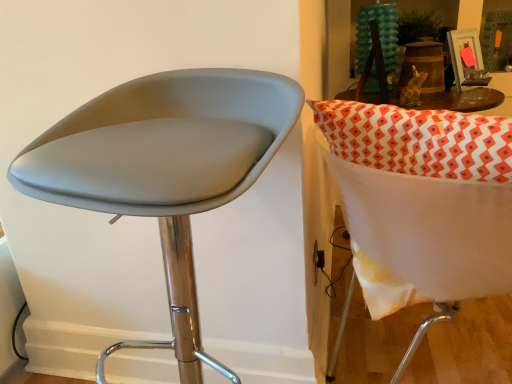
You are a GUI agent. You are given a task and a screenshot of the screen. Output one action in this format:
    pyautogui.click(x=<x>, y=<y>)
    Task: Click on the matte gray stool at left, placed as the second chair when sorted from right to left
    The width and height of the screenshot is (512, 384).
    Given the screenshot: What is the action you would take?
    pyautogui.click(x=165, y=163)

The height and width of the screenshot is (384, 512). Describe the element at coordinates (165, 163) in the screenshot. I see `matte gray stool at left, which is the 1th chair in left-to-right order` at that location.

Where is `white fabric chair at right, placed as the 2th chair when sorted from left to right`? white fabric chair at right, placed as the 2th chair when sorted from left to right is located at coordinates (425, 193).

What do you see at coordinates (425, 193) in the screenshot? Image resolution: width=512 pixels, height=384 pixels. I see `white fabric chair at right, placed as the 2th chair when sorted from left to right` at bounding box center [425, 193].

Identify the location of matte gray stool at left, placed as the second chair when sorted from right to left. (165, 163).

Does white fabric chair at right, which appears as the first chair when viewed from the right, appear on the right side of matte gray stool at left, which is the 1th chair in left-to-right order?

Yes, white fabric chair at right, which appears as the first chair when viewed from the right, is to the right of matte gray stool at left, which is the 1th chair in left-to-right order.

Is white fabric chair at right, placed as the 2th chair when sorted from left to right, positioned before matte gray stool at left, placed as the second chair when sorted from right to left?

No, white fabric chair at right, placed as the 2th chair when sorted from left to right, is further to the viewer.

Considering the positions of point (480, 238) and point (141, 172), is point (480, 238) closer or farther from the camera than point (141, 172)?

Clearly, point (480, 238) is more distant from the camera than point (141, 172).

From the image's perspective, would you say white fabric chair at right, which appears as the first chair when viewed from the right, is positioned over matte gray stool at left, which is the 1th chair in left-to-right order?

Yes.

From a real-world perspective, which is physically above, white fabric chair at right, placed as the 2th chair when sorted from left to right, or matte gray stool at left, placed as the second chair when sorted from right to left?

matte gray stool at left, placed as the second chair when sorted from right to left, from a real-world perspective.

Can you confirm if white fabric chair at right, which appears as the first chair when viewed from the right, is wider than matte gray stool at left, which is the 1th chair in left-to-right order?

Indeed, white fabric chair at right, which appears as the first chair when viewed from the right, has a greater width compared to matte gray stool at left, which is the 1th chair in left-to-right order.

Is white fabric chair at right, placed as the 2th chair when sorted from left to right, taller than matte gray stool at left, placed as the second chair when sorted from right to left?

Incorrect, the height of white fabric chair at right, placed as the 2th chair when sorted from left to right, is not larger of that of matte gray stool at left, placed as the second chair when sorted from right to left.

Which of these two, white fabric chair at right, placed as the 2th chair when sorted from left to right, or matte gray stool at left, placed as the second chair when sorted from right to left, is smaller?

With smaller size is matte gray stool at left, placed as the second chair when sorted from right to left.

Would you say white fabric chair at right, placed as the 2th chair when sorted from left to right, is outside matte gray stool at left, placed as the second chair when sorted from right to left?

Yes, white fabric chair at right, placed as the 2th chair when sorted from left to right, is outside of matte gray stool at left, placed as the second chair when sorted from right to left.

Would you consider white fabric chair at right, placed as the 2th chair when sorted from left to right, to be distant from matte gray stool at left, placed as the second chair when sorted from right to left?

white fabric chair at right, placed as the 2th chair when sorted from left to right, is actually quite close to matte gray stool at left, placed as the second chair when sorted from right to left.

Could you tell me if white fabric chair at right, which appears as the first chair when viewed from the right, is turned towards matte gray stool at left, placed as the second chair when sorted from right to left?

No, white fabric chair at right, which appears as the first chair when viewed from the right, is not facing towards matte gray stool at left, placed as the second chair when sorted from right to left.

This screenshot has height=384, width=512. Identify the location of chair in front of the white fabric chair at right, which appears as the first chair when viewed from the right. (165, 163).

Considering the positions of objects matte gray stool at left, which is the 1th chair in left-to-right order, and white fabric chair at right, which appears as the first chair when viewed from the right, in the image provided, who is more to the left, matte gray stool at left, which is the 1th chair in left-to-right order, or white fabric chair at right, which appears as the first chair when viewed from the right,?

matte gray stool at left, which is the 1th chair in left-to-right order, is more to the left.

Is matte gray stool at left, placed as the second chair when sorted from right to left, in front of or behind white fabric chair at right, placed as the 2th chair when sorted from left to right, in the image?

matte gray stool at left, placed as the second chair when sorted from right to left, is in front of white fabric chair at right, placed as the 2th chair when sorted from left to right.

In the scene shown: Which point is more distant from viewer, (277, 138) or (422, 138)?

The point (277, 138) is farther from the camera.

From the image's perspective, is matte gray stool at left, which is the 1th chair in left-to-right order, above white fabric chair at right, placed as the 2th chair when sorted from left to right?

Incorrect, from the image's perspective, matte gray stool at left, which is the 1th chair in left-to-right order, is lower than white fabric chair at right, placed as the 2th chair when sorted from left to right.

From a real-world perspective, is matte gray stool at left, which is the 1th chair in left-to-right order, physically below white fabric chair at right, which appears as the first chair when viewed from the right?

No, from a real-world perspective, matte gray stool at left, which is the 1th chair in left-to-right order, is not beneath white fabric chair at right, which appears as the first chair when viewed from the right.

In terms of width, does matte gray stool at left, placed as the second chair when sorted from right to left, look wider or thinner when compared to white fabric chair at right, which appears as the first chair when viewed from the right?

Clearly, matte gray stool at left, placed as the second chair when sorted from right to left, has less width compared to white fabric chair at right, which appears as the first chair when viewed from the right.

Which of these two, matte gray stool at left, which is the 1th chair in left-to-right order, or white fabric chair at right, placed as the 2th chair when sorted from left to right, stands taller?

With more height is matte gray stool at left, which is the 1th chair in left-to-right order.

In the scene shown: Considering the sizes of matte gray stool at left, placed as the second chair when sorted from right to left, and white fabric chair at right, which appears as the first chair when viewed from the right, in the image, is matte gray stool at left, placed as the second chair when sorted from right to left, bigger or smaller than white fabric chair at right, which appears as the first chair when viewed from the right,?

matte gray stool at left, placed as the second chair when sorted from right to left, is smaller than white fabric chair at right, which appears as the first chair when viewed from the right.

Would you say matte gray stool at left, which is the 1th chair in left-to-right order, is outside white fabric chair at right, which appears as the first chair when viewed from the right?

matte gray stool at left, which is the 1th chair in left-to-right order, lies outside white fabric chair at right, which appears as the first chair when viewed from the right,'s area.

Is there a large distance between matte gray stool at left, placed as the second chair when sorted from right to left, and white fabric chair at right, which appears as the first chair when viewed from the right?

Actually, matte gray stool at left, placed as the second chair when sorted from right to left, and white fabric chair at right, which appears as the first chair when viewed from the right, are a little close together.

Is matte gray stool at left, which is the 1th chair in left-to-right order, facing towards white fabric chair at right, placed as the 2th chair when sorted from left to right?

No, matte gray stool at left, which is the 1th chair in left-to-right order, does not turn towards white fabric chair at right, placed as the 2th chair when sorted from left to right.

What's the angular difference between matte gray stool at left, placed as the second chair when sorted from right to left, and white fabric chair at right, placed as the 2th chair when sorted from left to right,'s facing directions?

117 degrees separate the facing orientations of matte gray stool at left, placed as the second chair when sorted from right to left, and white fabric chair at right, placed as the 2th chair when sorted from left to right.

In the image, there is a matte gray stool at left, placed as the second chair when sorted from right to left. Identify the location of chair above it (from the image's perspective). The height and width of the screenshot is (384, 512). (425, 193).

Identify the location of chair above the white fabric chair at right, which appears as the first chair when viewed from the right (from a real-world perspective). The height and width of the screenshot is (384, 512). coord(165,163).

Find the location of a particular element. chair that appears on the right of matte gray stool at left, which is the 1th chair in left-to-right order is located at coordinates (425, 193).